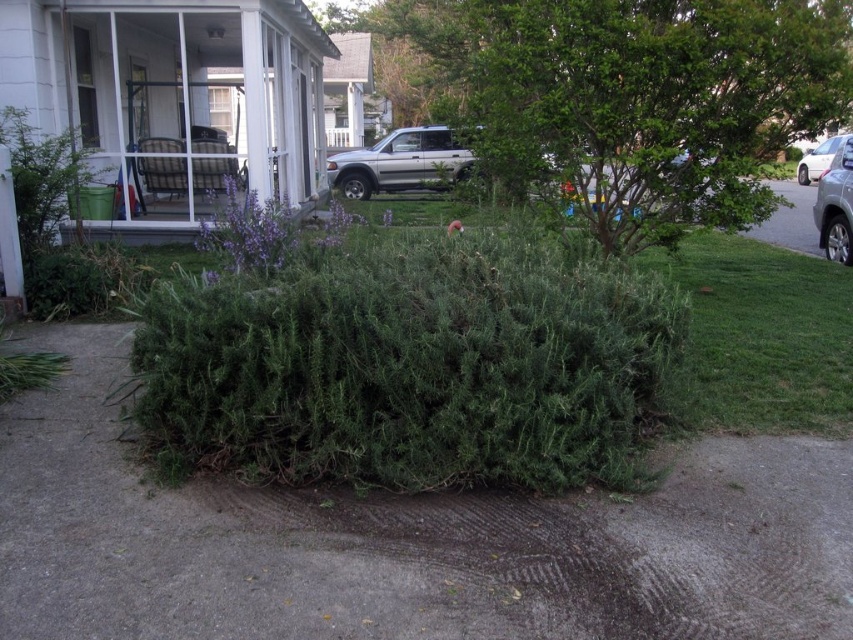
Question: Can you confirm if silver metallic car at right is positioned to the right of satin silver sedan at right?

Choices:
 (A) no
 (B) yes

Answer: (A)

Question: Considering the real-world distances, which object is closest to the green needle-like bush at center?

Choices:
 (A) silver metallic car at right
 (B) satin silver sedan at right
 (C) green leafy tree at center

Answer: (C)

Question: Does green leafy tree at center lie behind silver metallic car at right?

Choices:
 (A) no
 (B) yes

Answer: (A)

Question: Estimate the real-world distances between objects in this image. Which object is closer to the green needle-like bush at center?

Choices:
 (A) satin silver sedan at right
 (B) silver metallic car at right

Answer: (B)

Question: Which of the following is the closest to the observer?

Choices:
 (A) green leafy tree at center
 (B) silver metallic car at right
 (C) satin silver sedan at right

Answer: (A)

Question: Is green needle-like bush at center further to the viewer compared to green leafy tree at center?

Choices:
 (A) yes
 (B) no

Answer: (B)